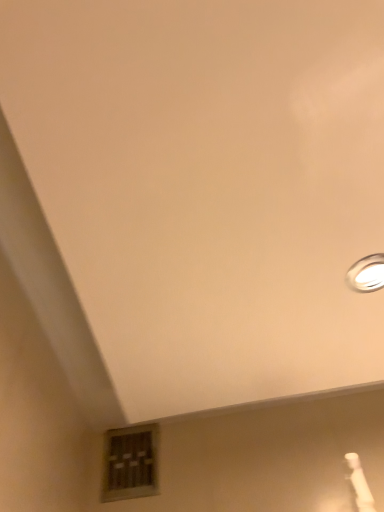
Locate an element on the screen. The height and width of the screenshot is (512, 384). white glossy lamp at upper right is located at coordinates (367, 274).

Measure the distance between white glossy lamp at upper right and camera.

white glossy lamp at upper right is 26.82 inches from camera.

What do you see at coordinates (367, 274) in the screenshot? This screenshot has width=384, height=512. I see `white glossy lamp at upper right` at bounding box center [367, 274].

Measure the distance between point (149,476) and camera.

Point (149,476) and camera are 3.93 feet apart from each other.

Describe the element at coordinates (130, 463) in the screenshot. I see `wooden window at lower center` at that location.

The image size is (384, 512). I want to click on wooden window at lower center, so click(x=130, y=463).

Locate an element on the screen. white glossy lamp at upper right is located at coordinates (367, 274).

Considering the relative positions of white glossy lamp at upper right and wooden window at lower center in the image provided, is white glossy lamp at upper right to the left of wooden window at lower center from the viewer's perspective?

No, white glossy lamp at upper right is not to the left of wooden window at lower center.

Does white glossy lamp at upper right lie behind wooden window at lower center?

No, white glossy lamp at upper right is closer to the camera.

Does point (382, 258) appear closer or farther from the camera than point (110, 433)?

Point (382, 258) is closer to the camera than point (110, 433).

From the image's perspective, is white glossy lamp at upper right located above or below wooden window at lower center?

From the image's perspective, white glossy lamp at upper right appears above wooden window at lower center.

From a real-world perspective, does white glossy lamp at upper right sit lower than wooden window at lower center?

Yes, from a real-world perspective, white glossy lamp at upper right is below wooden window at lower center.

Consider the image. Considering the sizes of objects white glossy lamp at upper right and wooden window at lower center in the image provided, who is thinner, white glossy lamp at upper right or wooden window at lower center?

wooden window at lower center.

Which of these two, white glossy lamp at upper right or wooden window at lower center, stands shorter?

With less height is white glossy lamp at upper right.

Considering the sizes of objects white glossy lamp at upper right and wooden window at lower center in the image provided, who is bigger, white glossy lamp at upper right or wooden window at lower center?

Bigger between the two is wooden window at lower center.

Is white glossy lamp at upper right surrounding wooden window at lower center?

Actually, wooden window at lower center is outside white glossy lamp at upper right.

Is white glossy lamp at upper right positioned far away from wooden window at lower center?

No, white glossy lamp at upper right is not far away from wooden window at lower center.

Is white glossy lamp at upper right facing towards wooden window at lower center?

No, white glossy lamp at upper right does not turn towards wooden window at lower center.

How many degrees apart are the facing directions of white glossy lamp at upper right and wooden window at lower center?

white glossy lamp at upper right and wooden window at lower center are facing 89.9 degrees away from each other.

In the image, there is a wooden window at lower center. Where is `lamp above it (from the image's perspective)`? Image resolution: width=384 pixels, height=512 pixels. lamp above it (from the image's perspective) is located at coordinates (367, 274).

Considering the positions of objects wooden window at lower center and white glossy lamp at upper right in the image provided, who is more to the right, wooden window at lower center or white glossy lamp at upper right?

white glossy lamp at upper right is more to the right.

Considering their positions, is wooden window at lower center located in front of or behind white glossy lamp at upper right?

Visually, wooden window at lower center is located behind white glossy lamp at upper right.

Which is in front, point (131, 438) or point (376, 289)?

The point (376, 289) is closer.

Consider the image. From the image's perspective, which object appears higher, wooden window at lower center or white glossy lamp at upper right?

From the image's view, white glossy lamp at upper right is above.

Looking at this image, from a real-world perspective, is wooden window at lower center physically located above or below white glossy lamp at upper right?

wooden window at lower center is situated higher than white glossy lamp at upper right in the real world.

Considering the sizes of wooden window at lower center and white glossy lamp at upper right in the image, is wooden window at lower center wider or thinner than white glossy lamp at upper right?

Clearly, wooden window at lower center has less width compared to white glossy lamp at upper right.

Can you confirm if wooden window at lower center is taller than white glossy lamp at upper right?

Yes, wooden window at lower center is taller than white glossy lamp at upper right.

Which of these two, wooden window at lower center or white glossy lamp at upper right, is bigger?

wooden window at lower center.

Is wooden window at lower center situated inside white glossy lamp at upper right or outside?

wooden window at lower center lies outside white glossy lamp at upper right.

Are wooden window at lower center and white glossy lamp at upper right beside each other?

No, wooden window at lower center is not with white glossy lamp at upper right.

Is wooden window at lower center aimed at white glossy lamp at upper right?

No, wooden window at lower center is not turned towards white glossy lamp at upper right.

Can you tell me how much wooden window at lower center and white glossy lamp at upper right differ in facing direction?

The facing directions of wooden window at lower center and white glossy lamp at upper right are 89.9 degrees apart.

Measure the distance between wooden window at lower center and white glossy lamp at upper right.

They are 29.15 inches apart.

I want to click on lamp in front of the wooden window at lower center, so click(x=367, y=274).

Find the location of a particular element. The image size is (384, 512). window that is on the left side of white glossy lamp at upper right is located at coordinates (130, 463).

What are the coordinates of `window located above the white glossy lamp at upper right (from a real-world perspective)` in the screenshot? It's located at (130, 463).